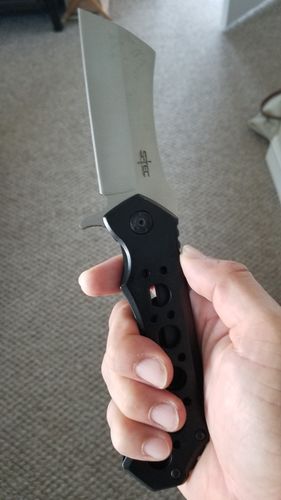
Where is `carpet`? The image size is (281, 500). carpet is located at coordinates (38, 418).